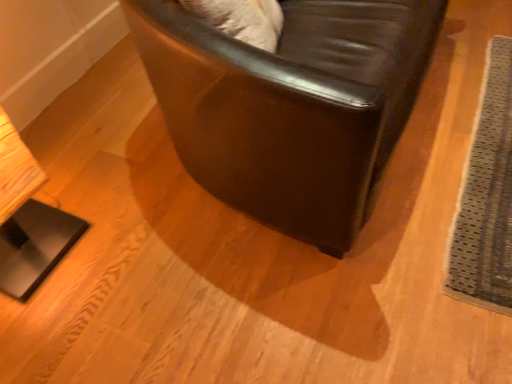
What do you see at coordinates (291, 106) in the screenshot? I see `shiny black leather chair at center` at bounding box center [291, 106].

What is the approximate height of shiny black leather chair at center?

It is 72.75 centimeters.

This screenshot has height=384, width=512. Identify the location of shiny black leather chair at center. (291, 106).

This screenshot has height=384, width=512. Describe the element at coordinates (486, 196) in the screenshot. I see `textured gray mat at lower right` at that location.

Measure the distance between point (444, 286) and camera.

Point (444, 286) and camera are 3.67 feet apart from each other.

Locate an element on the screen. textured gray mat at lower right is located at coordinates (486, 196).

I want to click on shiny black leather chair at center, so click(x=291, y=106).

Which object is positioned more to the left, shiny black leather chair at center or textured gray mat at lower right?

Positioned to the left is shiny black leather chair at center.

Between shiny black leather chair at center and textured gray mat at lower right, which one is positioned in front?

shiny black leather chair at center is in front.

Does point (249, 211) come farther from viewer compared to point (487, 100)?

That is False.

From the image's perspective, which object appears higher, shiny black leather chair at center or textured gray mat at lower right?

From the image's view, shiny black leather chair at center is above.

From a real-world perspective, which is physically above, shiny black leather chair at center or textured gray mat at lower right?

In real-world perspective, shiny black leather chair at center is above.

Is shiny black leather chair at center wider or thinner than textured gray mat at lower right?

shiny black leather chair at center is thinner than textured gray mat at lower right.

In terms of height, does shiny black leather chair at center look taller or shorter compared to textured gray mat at lower right?

In the image, shiny black leather chair at center appears to be taller than textured gray mat at lower right.

Which of these two, shiny black leather chair at center or textured gray mat at lower right, is bigger?

shiny black leather chair at center.

Consider the image. Is shiny black leather chair at center not within textured gray mat at lower right?

shiny black leather chair at center is positioned outside textured gray mat at lower right.

Is shiny black leather chair at center not near textured gray mat at lower right?

That's not correct — shiny black leather chair at center is a little close to textured gray mat at lower right.

Is textured gray mat at lower right at the back of shiny black leather chair at center?

No.

How different are the orientations of shiny black leather chair at center and textured gray mat at lower right in degrees?

They differ by 88.9 degrees in their facing directions.

Find the location of a particular element. The width and height of the screenshot is (512, 384). mat that is on the right side of shiny black leather chair at center is located at coordinates (486, 196).

Between textured gray mat at lower right and shiny black leather chair at center, which one appears on the left side from the viewer's perspective?

shiny black leather chair at center is more to the left.

Based on the photo, considering the relative positions of textured gray mat at lower right and shiny black leather chair at center in the image provided, is textured gray mat at lower right behind shiny black leather chair at center?

That is True.

Is point (470, 171) in front of point (276, 111)?

No, (470, 171) is behind (276, 111).

Consider the image. From the image's perspective, who appears lower, textured gray mat at lower right or shiny black leather chair at center?

textured gray mat at lower right, from the image's perspective.

From a real-world perspective, is textured gray mat at lower right on shiny black leather chair at center?

Actually, textured gray mat at lower right is physically below shiny black leather chair at center in the real world.

Looking at their sizes, would you say textured gray mat at lower right is wider or thinner than shiny black leather chair at center?

textured gray mat at lower right is wider than shiny black leather chair at center.

Is textured gray mat at lower right taller or shorter than shiny black leather chair at center?

textured gray mat at lower right is shorter than shiny black leather chair at center.

Does textured gray mat at lower right have a smaller size compared to shiny black leather chair at center?

Yes, textured gray mat at lower right is smaller than shiny black leather chair at center.

Does textured gray mat at lower right contain shiny black leather chair at center?

No, shiny black leather chair at center is not a part of textured gray mat at lower right.

Is textured gray mat at lower right far from shiny black leather chair at center?

That's not correct — textured gray mat at lower right is a little close to shiny black leather chair at center.

Is textured gray mat at lower right aimed at shiny black leather chair at center?

No, textured gray mat at lower right is not aimed at shiny black leather chair at center.

From the picture: How different are the orientations of textured gray mat at lower right and shiny black leather chair at center in degrees?

textured gray mat at lower right and shiny black leather chair at center are facing 88.9 degrees away from each other.

How much distance is there between textured gray mat at lower right and shiny black leather chair at center?

textured gray mat at lower right and shiny black leather chair at center are 22.29 inches apart.

Image resolution: width=512 pixels, height=384 pixels. Find the location of `chair located in front of the textured gray mat at lower right`. chair located in front of the textured gray mat at lower right is located at coordinates (291, 106).

There is a textured gray mat at lower right. Where is `chair above it (from a real-world perspective)`? The width and height of the screenshot is (512, 384). chair above it (from a real-world perspective) is located at coordinates (291, 106).

I want to click on mat on the right of shiny black leather chair at center, so click(486, 196).